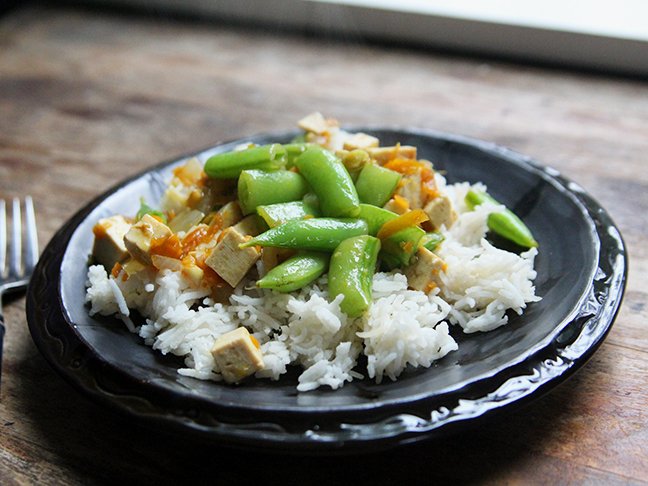
I want to click on raised edge along table, so click(x=247, y=13), click(x=307, y=16), click(x=415, y=18), click(x=502, y=30), click(x=568, y=43), click(x=608, y=48).